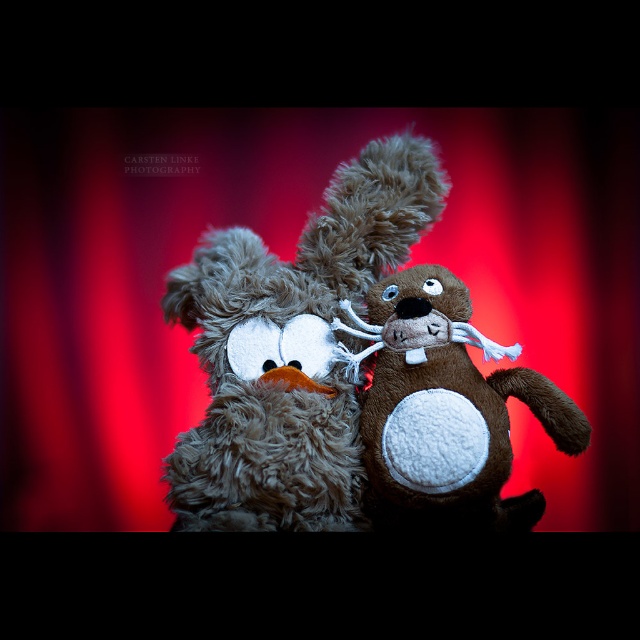
Question: Observing the image, what is the correct spatial positioning of red velvet curtain at center in reference to fuzzy brown teddy bear at center?

Choices:
 (A) right
 (B) left

Answer: (A)

Question: Which point is farther to the camera?

Choices:
 (A) red velvet curtain at center
 (B) brown plush toy at center
 (C) fuzzy brown teddy bear at center

Answer: (A)

Question: Which of the following is the farthest from the observer?

Choices:
 (A) (404, 344)
 (B) (214, 396)
 (C) (628, 173)

Answer: (C)

Question: Estimate the real-world distances between objects in this image. Which object is farther from the fuzzy brown teddy bear at center?

Choices:
 (A) red velvet curtain at center
 (B) brown plush toy at center

Answer: (A)

Question: Does fuzzy brown teddy bear at center have a smaller size compared to brown plush toy at center?

Choices:
 (A) no
 (B) yes

Answer: (A)

Question: Does fuzzy brown teddy bear at center have a greater width compared to brown plush toy at center?

Choices:
 (A) yes
 (B) no

Answer: (A)